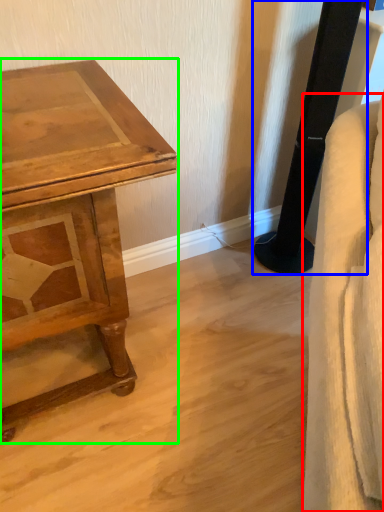
Question: Based on their relative distances, which object is farther from swivel chair (highlighted by a red box)? Choose from pillar (highlighted by a blue box) and table (highlighted by a green box).

Choices:
 (A) pillar
 (B) table

Answer: (A)